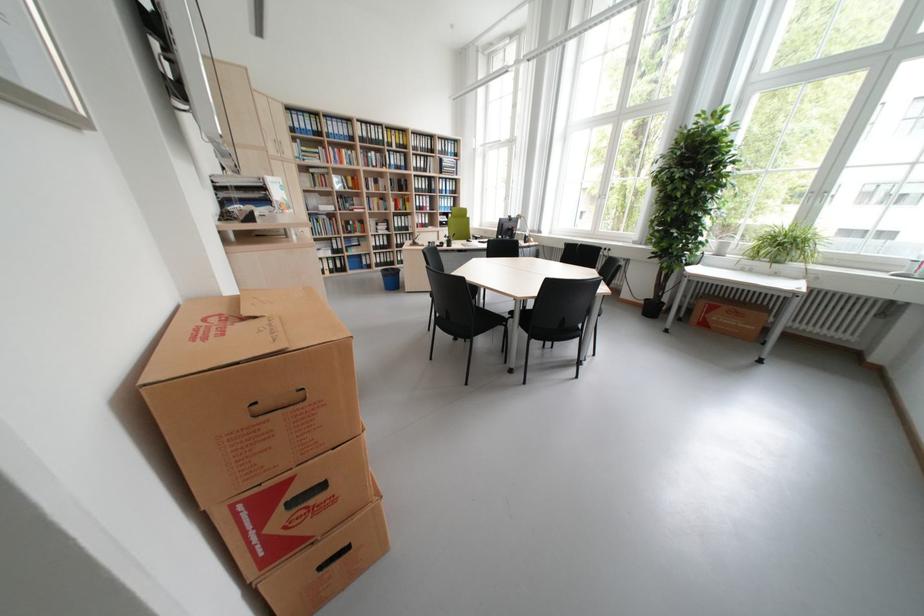
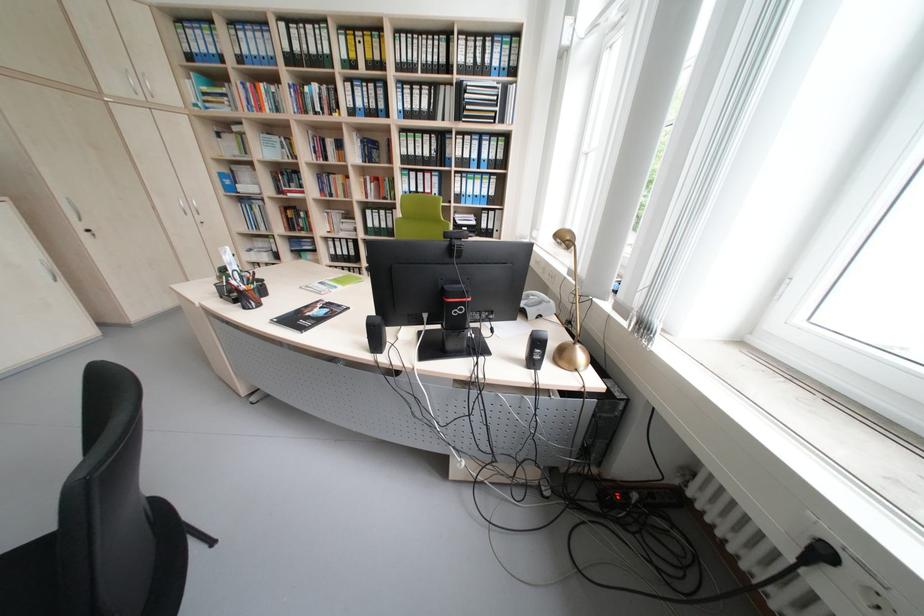
Where in the second image is the point corresponding to pixel 451 174 from the first image?

(468, 119)